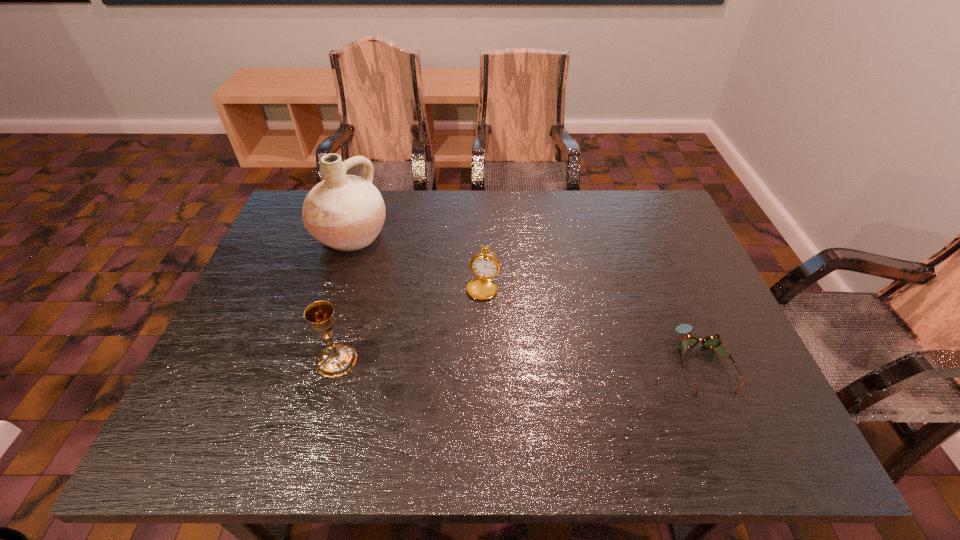
This screenshot has height=540, width=960. I want to click on object that is at the near right corner, so click(712, 341).

The width and height of the screenshot is (960, 540). In the image, there is a desktop. In order to click on vacant space at the far edge in this screenshot , I will do `click(575, 220)`.

You are a GUI agent. You are given a task and a screenshot of the screen. Output one action in this format:
    pyautogui.click(x=<x>, y=<y>)
    Task: Click on the free space at the near edge
    The height and width of the screenshot is (540, 960).
    Given the screenshot: What is the action you would take?
    pyautogui.click(x=373, y=410)

Locate an element on the screen. free space at the left edge of the desktop is located at coordinates (273, 267).

The height and width of the screenshot is (540, 960). In the image, there is a desktop. In order to click on free region at the right edge in this screenshot , I will do [690, 320].

This screenshot has width=960, height=540. What are the coordinates of `vacant area at the near left corner of the desktop` in the screenshot? It's located at (192, 404).

You are a GUI agent. You are given a task and a screenshot of the screen. Output one action in this format:
    pyautogui.click(x=<x>, y=<y>)
    Task: Click on the vacant area that lies between the chalice and the second farthest object
    The height and width of the screenshot is (540, 960).
    Given the screenshot: What is the action you would take?
    pyautogui.click(x=415, y=324)

This screenshot has height=540, width=960. In order to click on free space between the second tallest object and the pottery in this screenshot , I will do `click(344, 298)`.

Locate an element on the screen. The image size is (960, 540). free space between the rightmost object and the second tallest object is located at coordinates (519, 361).

Find the location of `free space between the second shortest object and the shortest object`. free space between the second shortest object and the shortest object is located at coordinates (598, 325).